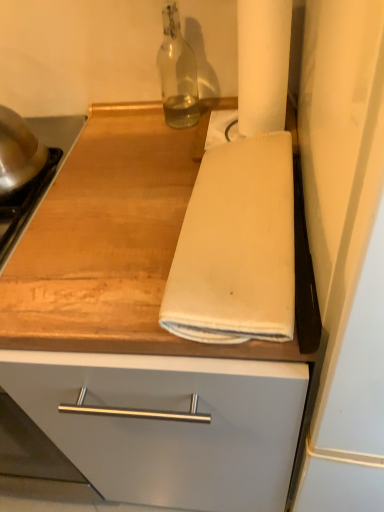
Question: Would you say wooden at center is to the left or to the right of white cotton towel at center in the picture?

Choices:
 (A) right
 (B) left

Answer: (B)

Question: From the image's perspective, relative to white cotton towel at center, is wooden at center above or below?

Choices:
 (A) above
 (B) below

Answer: (B)

Question: Estimate the real-world distances between objects in this image. Which object is farther from the white matte paper towel at upper right?

Choices:
 (A) white cotton towel at center
 (B) transparent glass bottle at upper center
 (C) wooden at center

Answer: (C)

Question: Which of these objects is positioned farthest from the white matte paper towel at upper right?

Choices:
 (A) transparent glass bottle at upper center
 (B) white cotton towel at center
 (C) wooden at center

Answer: (C)